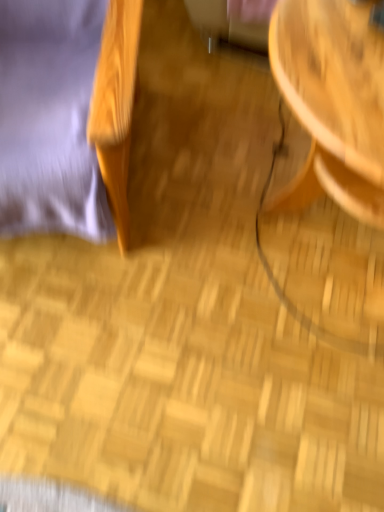
Find the location of a particular element. The height and width of the screenshot is (512, 384). velvet purple bean bag chair at left is located at coordinates (67, 115).

What do you see at coordinates (67, 115) in the screenshot? The image size is (384, 512). I see `velvet purple bean bag chair at left` at bounding box center [67, 115].

The height and width of the screenshot is (512, 384). What are the coordinates of `velvet purple bean bag chair at left` in the screenshot? It's located at (67, 115).